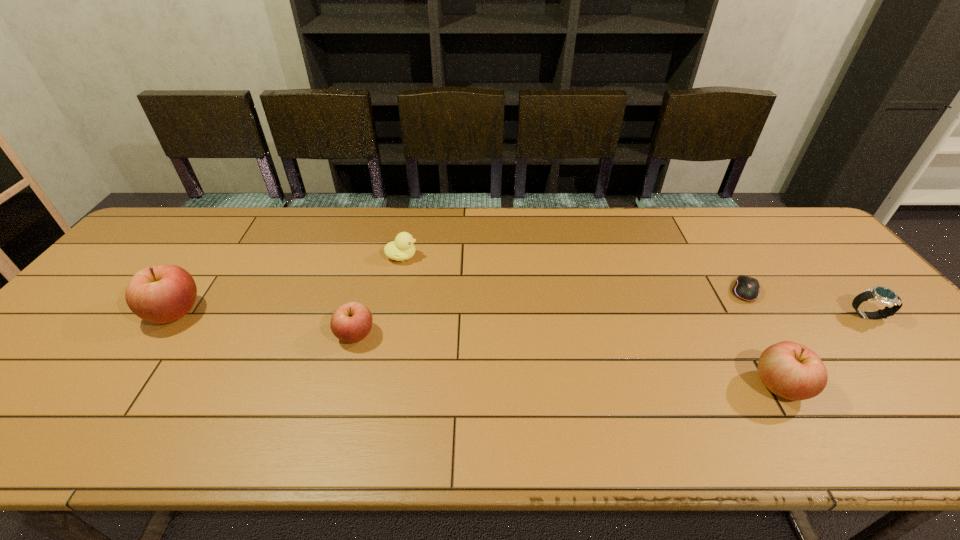
Find the location of a particular element. Image resolution: width=960 pixels, height=540 pixels. the leftmost object is located at coordinates (161, 294).

In order to click on the tallest object in this screenshot , I will do `click(161, 294)`.

I want to click on the shortest apple, so click(x=351, y=322).

Locate an element on the screen. The height and width of the screenshot is (540, 960). the nearest object is located at coordinates (790, 370).

The height and width of the screenshot is (540, 960). In order to click on the nearest apple in this screenshot , I will do `click(790, 370)`.

The height and width of the screenshot is (540, 960). What are the coordinates of `the farthest object` in the screenshot? It's located at (401, 249).

The height and width of the screenshot is (540, 960). Identify the location of watch. (883, 295).

Where is `computer mouse`? The width and height of the screenshot is (960, 540). computer mouse is located at coordinates (747, 288).

The height and width of the screenshot is (540, 960). Find the location of `free location located 0.090m on the front of the tallest apple`. free location located 0.090m on the front of the tallest apple is located at coordinates (138, 364).

This screenshot has height=540, width=960. What are the coordinates of `vacant space positioned on the back of the shortest apple` in the screenshot? It's located at point(383,233).